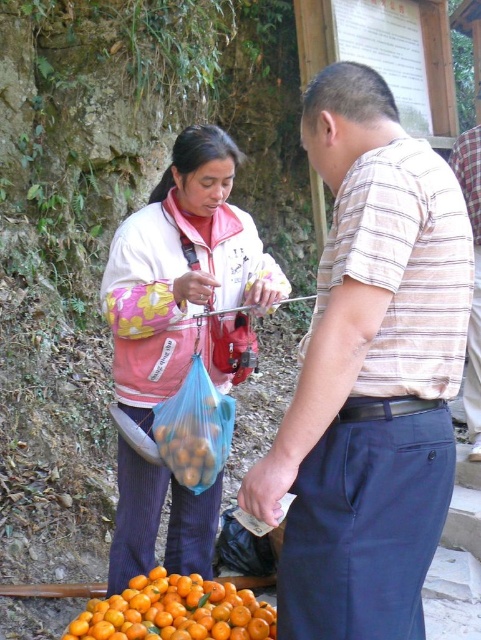
Is striped cotton shirt at center further to camera compared to pink fabric jacket at center?

No.

Can you confirm if striped cotton shirt at center is positioned to the right of pink fabric jacket at center?

Yes, striped cotton shirt at center is to the right of pink fabric jacket at center.

Locate an element on the screen. striped cotton shirt at center is located at coordinates (369, 374).

Does striped cotton shirt at center appear under orange matte fruit at lower center?

No, striped cotton shirt at center is not below orange matte fruit at lower center.

This screenshot has height=640, width=481. Find the location of `striped cotton shirt at center`. striped cotton shirt at center is located at coordinates (369, 374).

Who is more forward, [133,349] or [247,589]?

Point [133,349]

Does point (109, 323) lie in front of point (140, 608)?

No, it is not.

The image size is (481, 640). I want to click on pink fabric jacket at center, so click(180, 269).